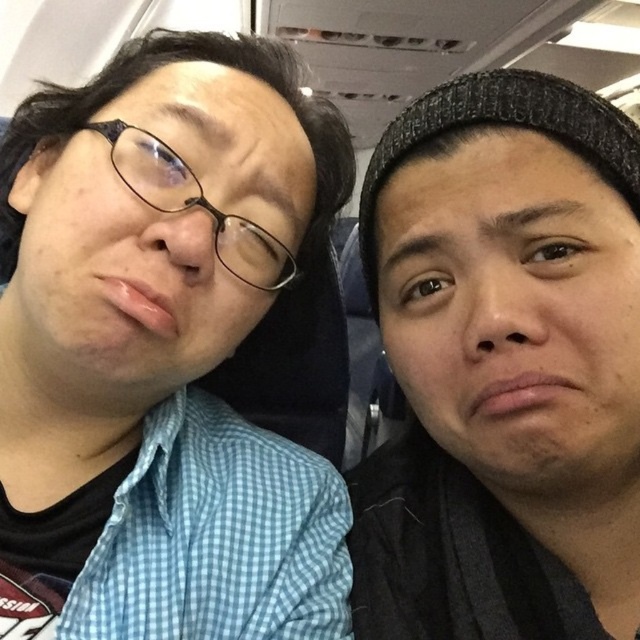
You are a flight attendant checking seat dimensions. The blue checkered shirt at left and the black knit cap at upper right are on adjacent seats. If the seat height is 24 inches, can both items fit without exceeding the seat height?

The blue checkered shirt at left is taller than the black knit cap at upper right. Since the seat height is 24 inches, both items can fit as long as their combined height does not exceed 24 inches. However, since the blue checkered shirt at left is taller, it must individually be less than or equal to 24 inches to fit without exceeding the seat height.

Consider the image. You are a flight attendant checking seat assignments. The seat map shows that the passenger in the blue checkered shirt at left is seated at coordinate point 0.556, 0.247. If the airplane cabin has a coordinate system where the front is 0 and the back is 1, and the left side is 0 and the right side is 1, can you confirm if this passenger is seated in the front half of the cabin?

The blue checkered shirt at left is positioned at point (157, 355). Since the coordinate system measures from front to back as 0 to 1, the first coordinate 0.556 indicates the position along the front to back axis. Since 0.556 is greater than 0.5, this means the passenger is seated in the back half of the cabin.